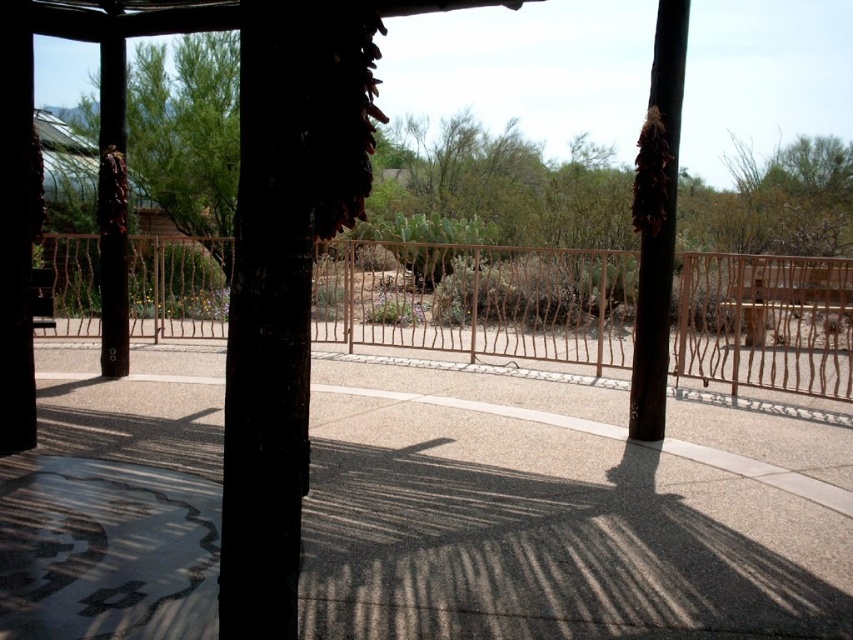
Question: Is rustic wood fence at center positioned at the back of brown rough wood pole at right?

Choices:
 (A) no
 (B) yes

Answer: (B)

Question: Estimate the real-world distances between objects in this image. Which object is closer to the brown wood pole at left?

Choices:
 (A) rustic wood fence at center
 (B) brown rough wood pole at right

Answer: (B)

Question: Which of these objects is positioned closest to the brown wood pole at left?

Choices:
 (A) rustic wood fence at center
 (B) brown rough wood pole at right

Answer: (B)

Question: Does rustic wood fence at center appear on the right side of brown wood pole at left?

Choices:
 (A) no
 (B) yes

Answer: (B)

Question: Based on their relative distances, which object is farther from the brown rough wood pole at right?

Choices:
 (A) brown wood pole at left
 (B) rustic wood fence at center

Answer: (B)

Question: Can you confirm if rustic wood fence at center is thinner than brown wood pole at left?

Choices:
 (A) yes
 (B) no

Answer: (B)